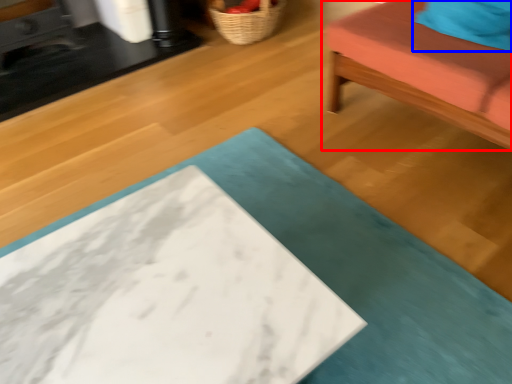
Question: Which object appears closest to the camera in this image, furniture (highlighted by a red box) or pillow (highlighted by a blue box)?

Choices:
 (A) furniture
 (B) pillow

Answer: (A)